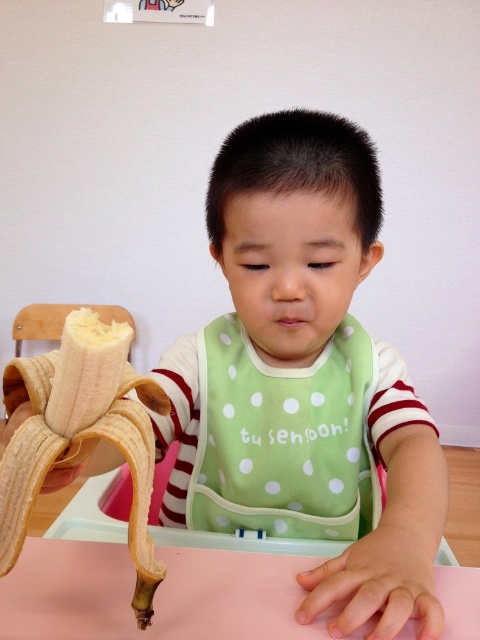
Question: Can you confirm if pink matte table at lower center is positioned to the left of yellow matte banana at lower left?

Choices:
 (A) no
 (B) yes

Answer: (A)

Question: Which object is farther from the camera taking this photo?

Choices:
 (A) pink matte table at lower center
 (B) yellow matte banana at lower left

Answer: (A)

Question: In this image, where is pink matte table at lower center located relative to yellow matte banana at lower left?

Choices:
 (A) left
 (B) right

Answer: (B)

Question: Is pink matte table at lower center to the right of yellow matte banana at lower left from the viewer's perspective?

Choices:
 (A) yes
 (B) no

Answer: (A)